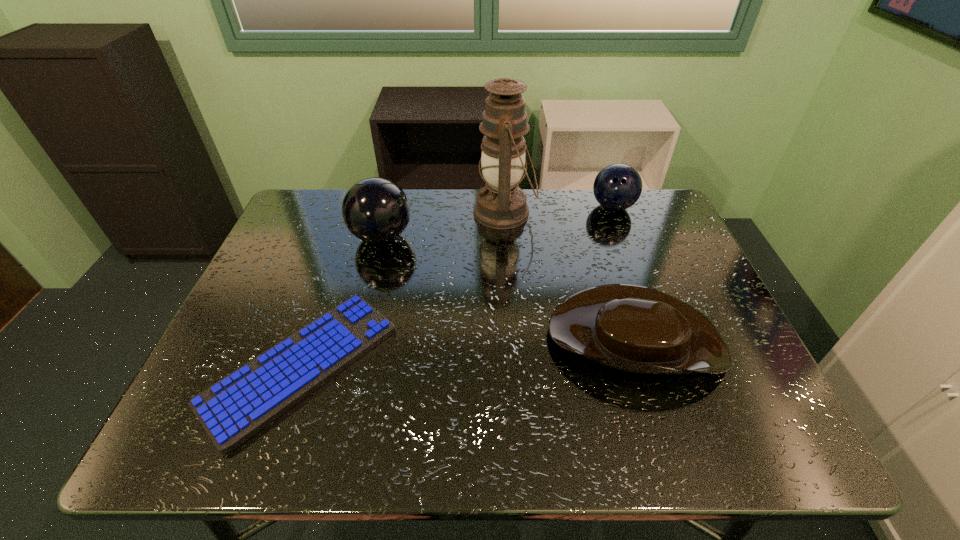
What are the coordinates of `free space at the near edge of the desktop` in the screenshot? It's located at (645, 416).

Find the location of `free space at the left edge of the desktop`. free space at the left edge of the desktop is located at coordinates (286, 247).

You are a GUI agent. You are given a task and a screenshot of the screen. Output one action in this format:
    pyautogui.click(x=<x>, y=<y>)
    Task: Click on the blank space at the right edge of the desktop
    This screenshot has width=960, height=540.
    Given the screenshot: What is the action you would take?
    pyautogui.click(x=692, y=278)

This screenshot has width=960, height=540. I want to click on vacant space at the far left corner of the desktop, so click(x=330, y=195).

Locate an element on the screen. The height and width of the screenshot is (540, 960). vacant space at the near right corner of the desktop is located at coordinates (756, 431).

You are a GUI agent. You are given a task and a screenshot of the screen. Output one action in this format:
    pyautogui.click(x=<x>, y=<y>)
    Task: Click on the unoccupied position between the right bowling ball and the oil lamp
    The height and width of the screenshot is (540, 960).
    Given the screenshot: What is the action you would take?
    pyautogui.click(x=559, y=210)

The width and height of the screenshot is (960, 540). I want to click on free point between the shortest object and the second shortest object, so click(x=468, y=350).

I want to click on vacant area that lies between the tallest object and the computer keyboard, so click(403, 289).

Where is `vacant point located between the left bowling ball and the shortest object`? The height and width of the screenshot is (540, 960). vacant point located between the left bowling ball and the shortest object is located at coordinates (341, 301).

The image size is (960, 540). Find the location of `free space between the fourth tallest object and the third tallest object`. free space between the fourth tallest object and the third tallest object is located at coordinates (623, 271).